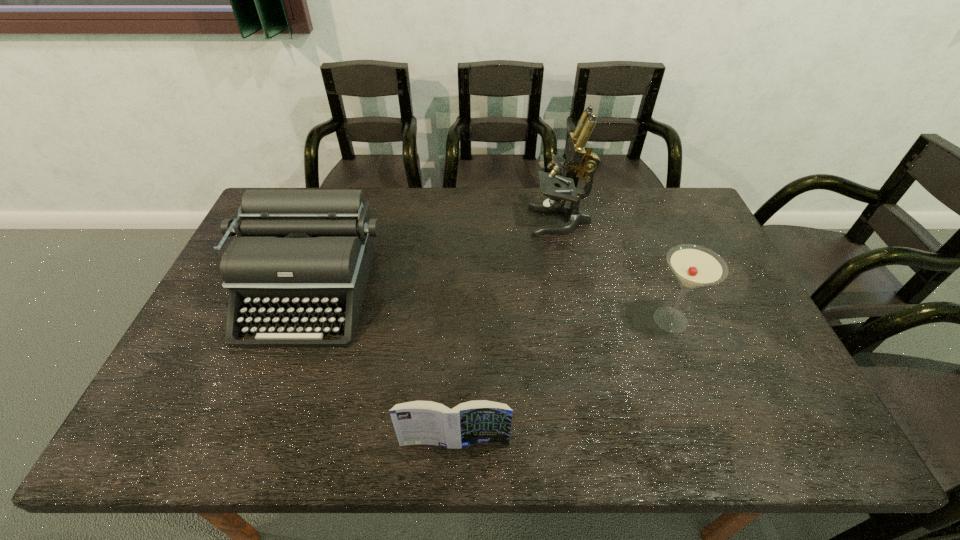
In order to click on the farthest object in this screenshot , I will do `click(579, 153)`.

Find the location of a particular element. microscope is located at coordinates (x=579, y=153).

Locate an element on the screen. the leftmost object is located at coordinates (301, 252).

The image size is (960, 540). Identify the location of the rightmost object. (694, 266).

Where is `the shortest object`? the shortest object is located at coordinates (418, 422).

Locate an element on the screen. This screenshot has width=960, height=540. book is located at coordinates (418, 422).

Image resolution: width=960 pixels, height=540 pixels. Identify the location of free space located 0.140m at the eyepieces of the farthest object. (489, 221).

The width and height of the screenshot is (960, 540). I want to click on vacant space located 0.400m at the eyepieces of the farthest object, so click(411, 221).

I want to click on vacant position located at the eyepieces of the farthest object, so click(x=411, y=221).

Identify the location of vacant point located on the typing side of the leftmost object. This screenshot has width=960, height=540. (268, 405).